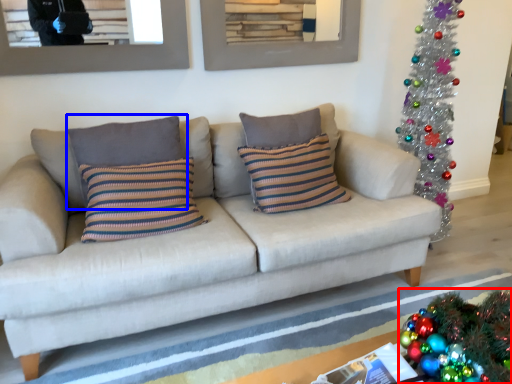
Question: Which object is further to the camera taking this photo, christmas decoration (highlighted by a red box) or pillow (highlighted by a blue box)?

Choices:
 (A) christmas decoration
 (B) pillow

Answer: (B)